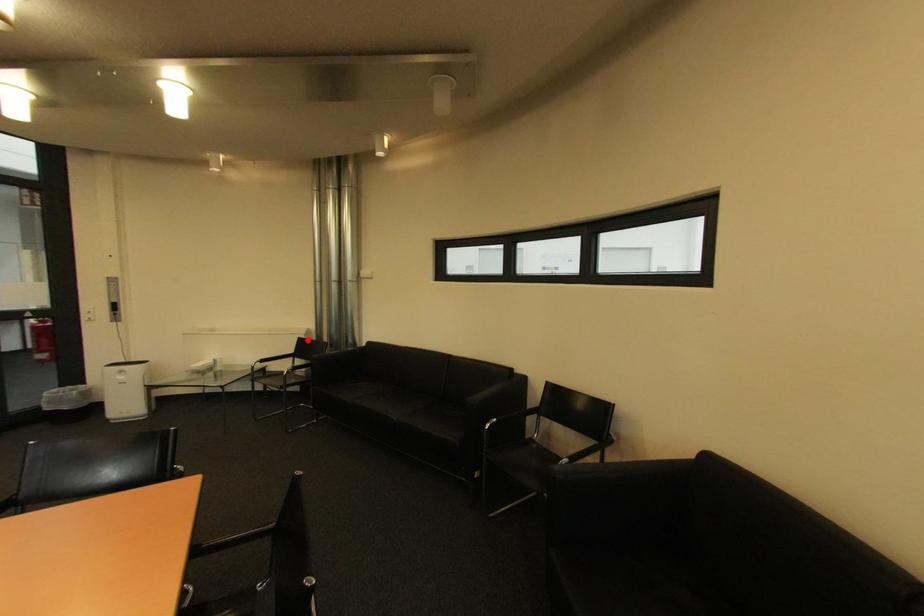
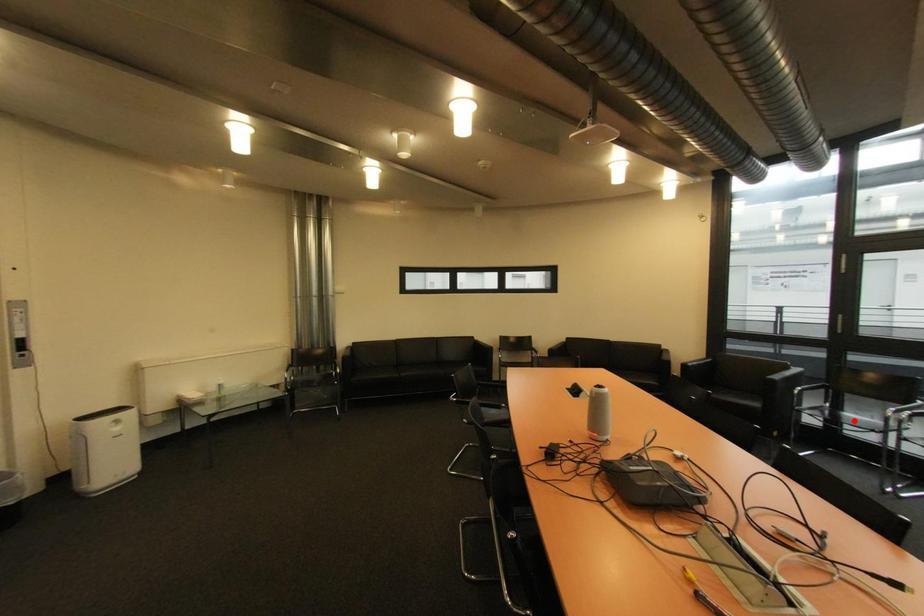
I am providing you with two images of the same scene from different viewpoints. A red point is marked on the first image and another point is marked on the second image. Are the points marked in image1 and image2 representing the same 3D position?

No